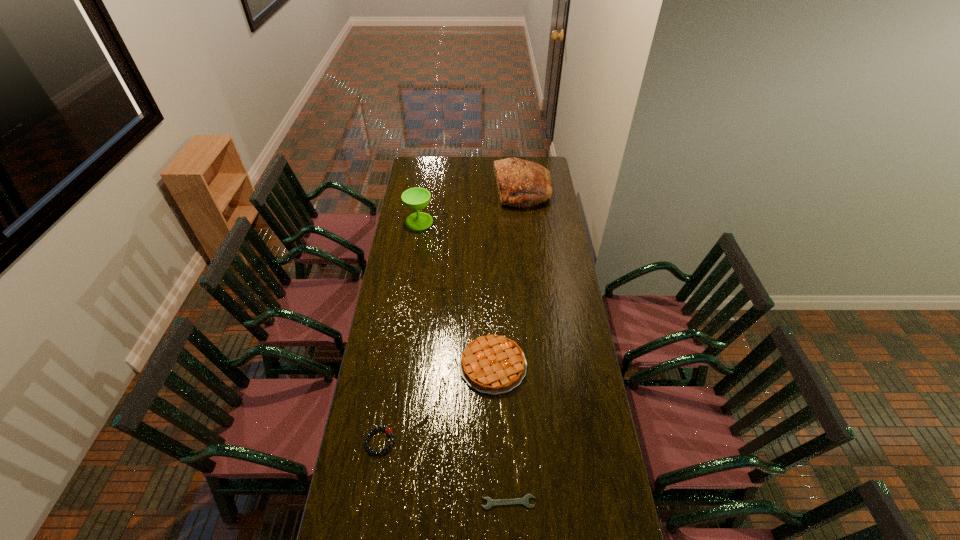
In the image, there is a desktop. In order to click on free space at the far edge in this screenshot , I will do `click(479, 164)`.

Identify the location of vacant space at the left edge of the desktop. Image resolution: width=960 pixels, height=540 pixels. (399, 247).

Where is `vacant space at the right edge of the desktop`? The height and width of the screenshot is (540, 960). vacant space at the right edge of the desktop is located at coordinates (575, 416).

This screenshot has width=960, height=540. Find the location of `vacant space in between the fourth tallest object and the pie`. vacant space in between the fourth tallest object and the pie is located at coordinates (437, 403).

Identify the location of free space between the second farthest object and the third nearest object. (456, 293).

The width and height of the screenshot is (960, 540). What are the coordinates of `free spot between the third shortest object and the bracelet` in the screenshot? It's located at (437, 403).

The height and width of the screenshot is (540, 960). Find the location of `free space between the second nearest object and the third nearest object`. free space between the second nearest object and the third nearest object is located at coordinates (437, 403).

Locate an element on the screen. free space between the third shortest object and the wrench is located at coordinates (501, 434).

Where is `free space between the third shortest object and the bracelet`? Image resolution: width=960 pixels, height=540 pixels. free space between the third shortest object and the bracelet is located at coordinates click(437, 403).

Where is `empty space that is in between the wineglass and the bracelet`? The height and width of the screenshot is (540, 960). empty space that is in between the wineglass and the bracelet is located at coordinates (399, 331).